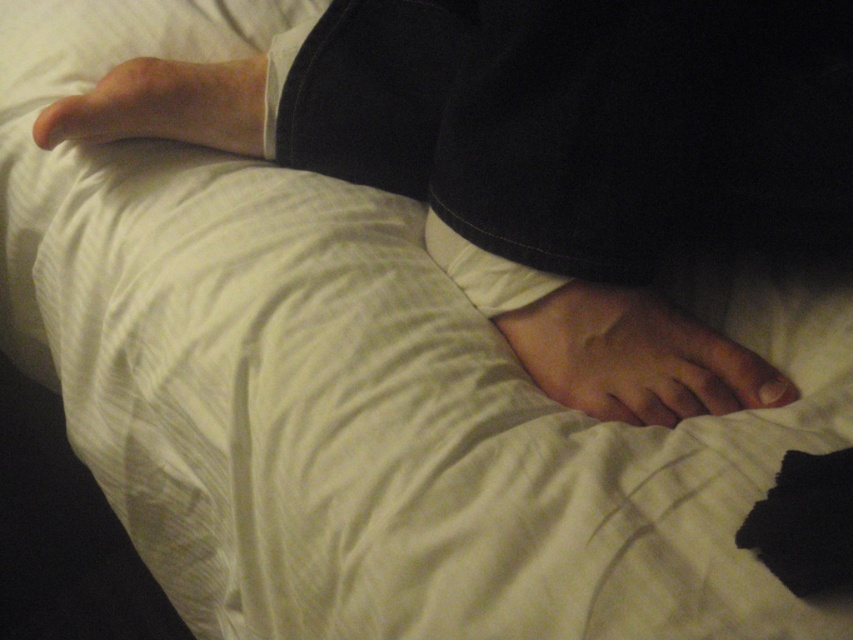
Between smooth skin foot at center and matte skin foot at upper left, which one is positioned higher?

Positioned higher is matte skin foot at upper left.

Is smooth skin foot at center bigger than matte skin foot at upper left?

Correct, smooth skin foot at center is larger in size than matte skin foot at upper left.

Identify the location of smooth skin foot at center. (635, 356).